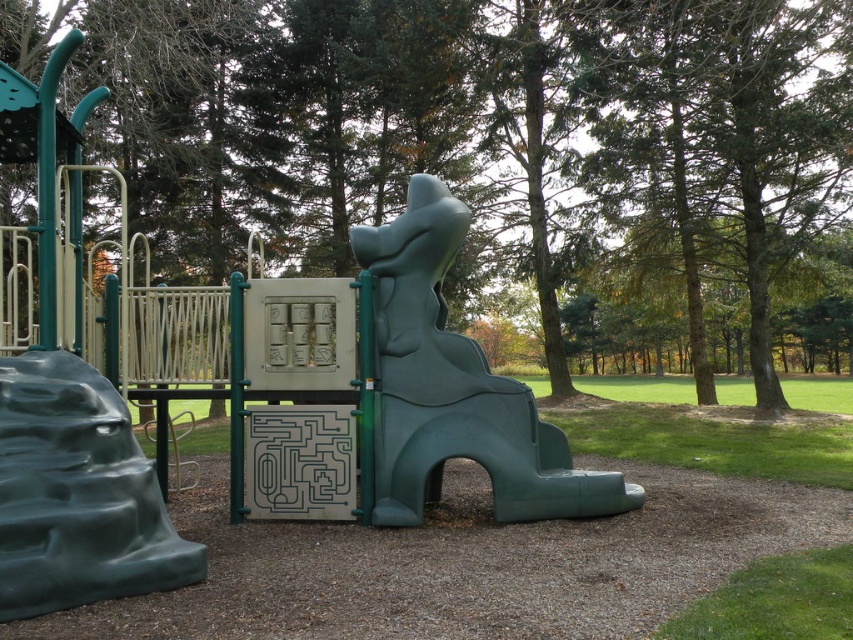
Who is taller, teal matte slide at center or green rubber slide at lower left?

teal matte slide at center

Does teal matte slide at center have a smaller size compared to green rubber slide at lower left?

Actually, teal matte slide at center might be larger than green rubber slide at lower left.

Is point (387, 269) less distant than point (0, 552)?

No, (387, 269) is further to viewer.

This screenshot has height=640, width=853. I want to click on teal matte slide at center, so click(456, 387).